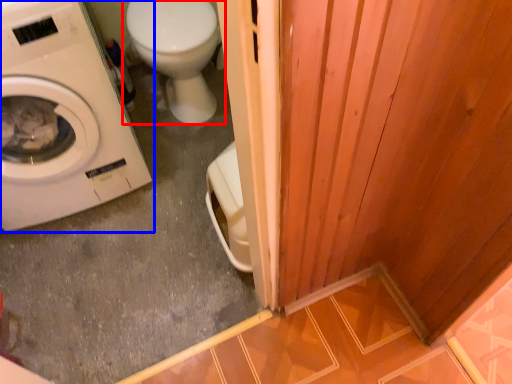
Question: Which object is further to the camera taking this photo, toilet (highlighted by a red box) or washing machine (highlighted by a blue box)?

Choices:
 (A) toilet
 (B) washing machine

Answer: (A)